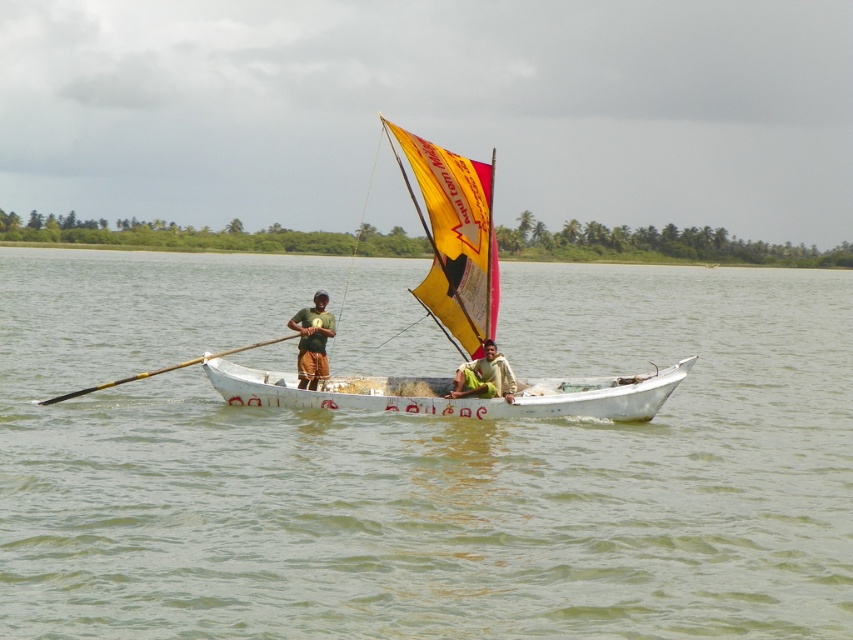
You are a photographer trying to capture the two points marked on the boat. Which point, point (405, 410) or point (221, 355), will appear larger in your photo?

Point (405, 410) is closer to the camera than point (221, 355), so it will appear larger in the photo.

From the picture: You are a sailor on the boat and need to adjust the sail. Considering the height of the yellow fabric sail at center compared to the green fabric shirt at center, can you reach the top of the sail without standing on anything?

The yellow fabric sail at center is taller than the green fabric shirt at center. Since the sail is taller than the shirt, and assuming the shirt wearer is standing upright, the top of the sail is likely out of reach without using a ladder or stepping on something.